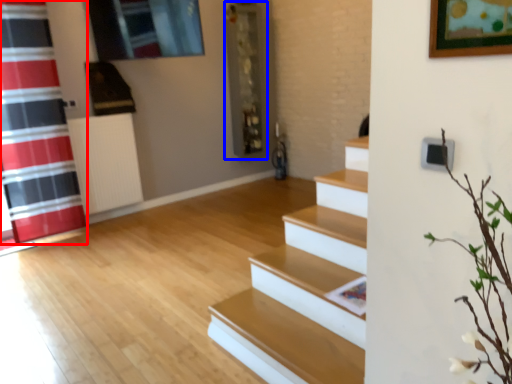
Question: Which object is further to the camera taking this photo, shower curtain (highlighted by a red box) or shelf (highlighted by a blue box)?

Choices:
 (A) shower curtain
 (B) shelf

Answer: (B)